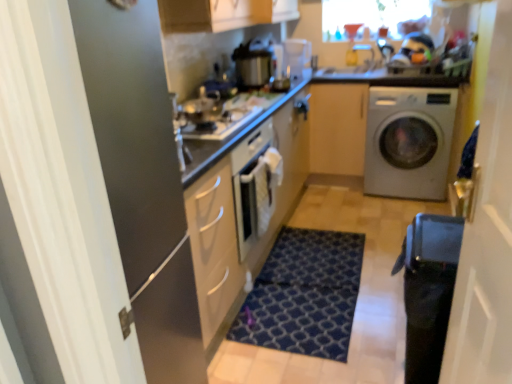
What are the coordinates of `free space behind black glossy water heater at lower right` in the screenshot? It's located at (383, 314).